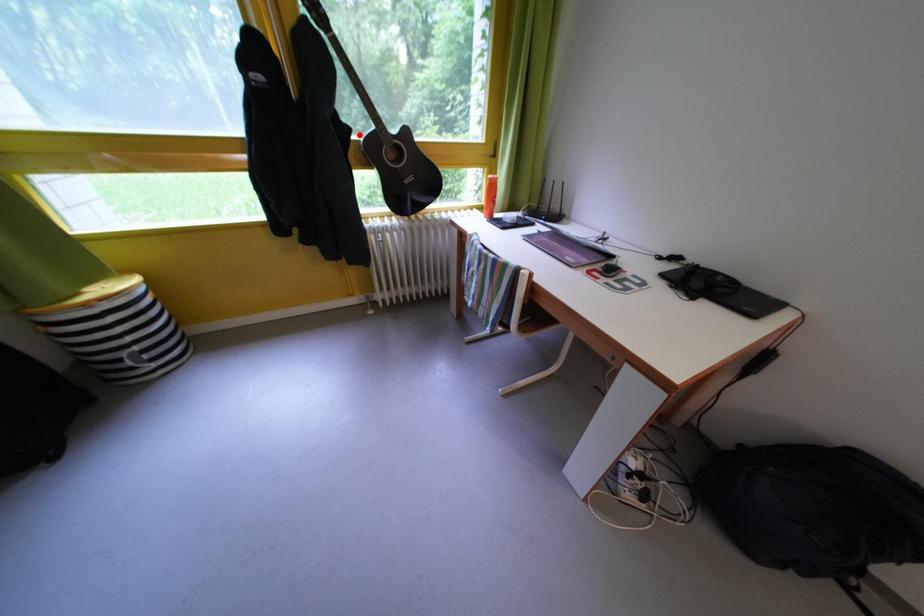
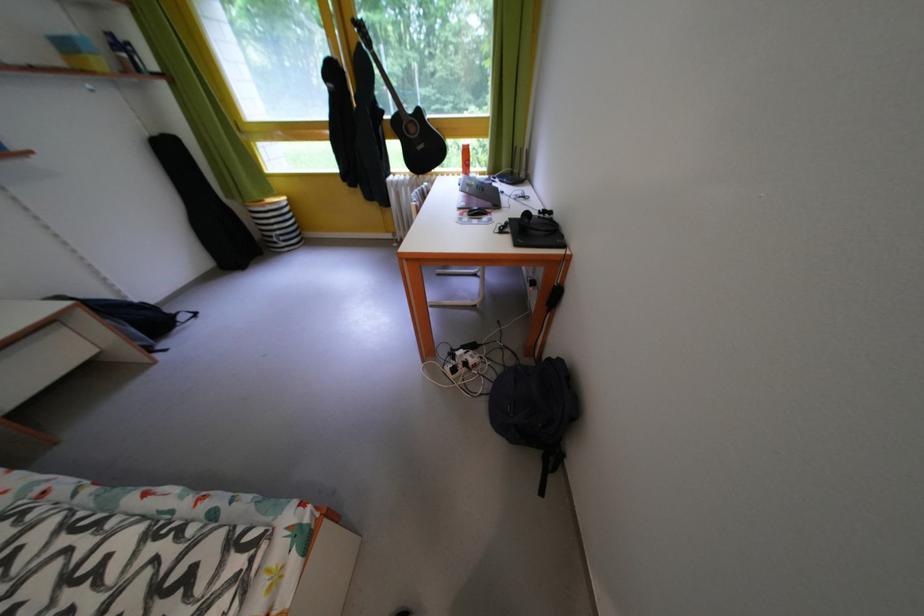
Question: I am providing you with two images of the same scene from different viewpoints. In image1, a red point is highlighted. Considering the same 3D point in image2, which of the following is correct?

Choices:
 (A) It is closer
 (B) It is farther

Answer: (A)